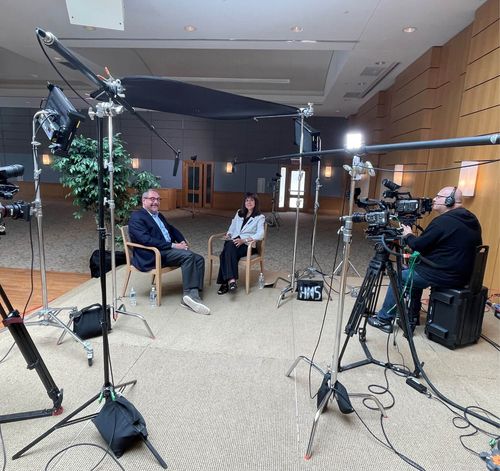
This screenshot has width=500, height=471. I want to click on large black speaker, so click(x=458, y=322).